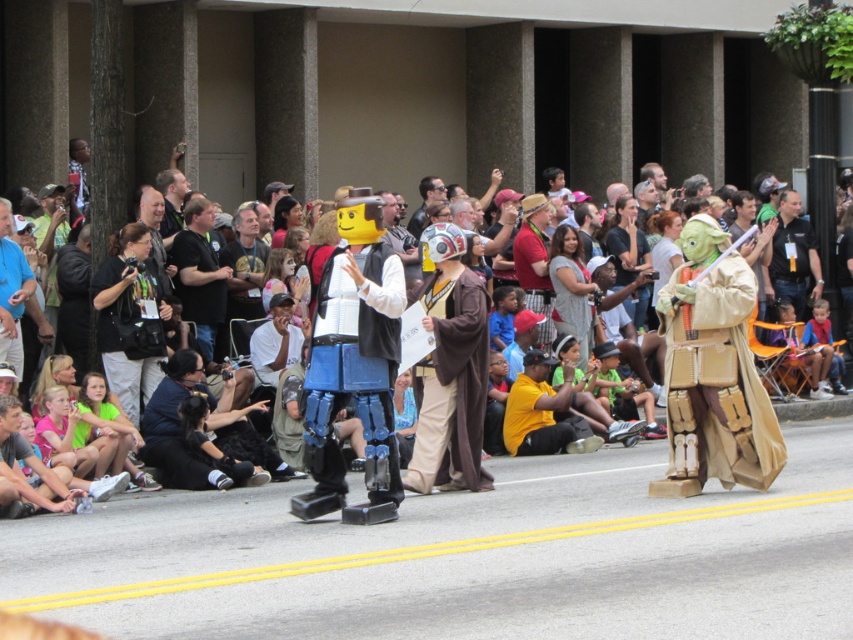
Is blue metallic robot at center bigger than black shirt at center?

No, blue metallic robot at center is not bigger than black shirt at center.

Between point (397, 429) and point (196, 317), which one is positioned behind?

The point (196, 317) is more distant.

The image size is (853, 640). What are the coordinates of `blue metallic robot at center` in the screenshot? It's located at (334, 403).

Between black fabric camera at center and dark blue shirt at center, which one has less height?

With less height is dark blue shirt at center.

Does black fabric camera at center have a lesser height compared to dark blue shirt at center?

No, black fabric camera at center is not shorter than dark blue shirt at center.

Who is more forward, (135, 262) or (790, 200)?

Point (135, 262) is more forward.

I want to click on black fabric camera at center, so click(129, 317).

Does blue metallic robot at center appear over dark blue shirt at center?

Incorrect, blue metallic robot at center is not positioned above dark blue shirt at center.

Between point (334, 477) and point (804, 288), which one is positioned in front?

Point (334, 477) is more forward.

What are the coordinates of `blue metallic robot at center` in the screenshot? It's located at (334, 403).